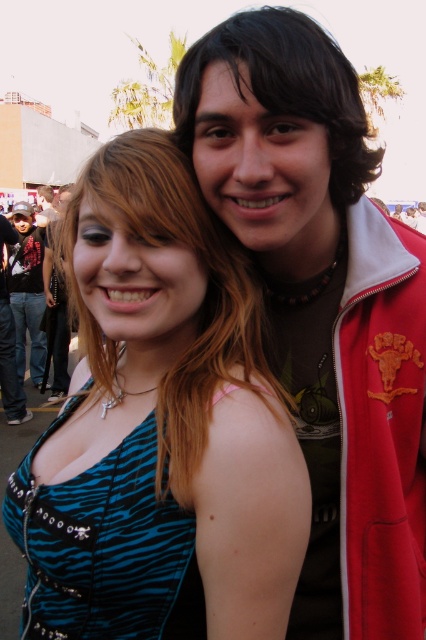
You are a photographer at a beach event and need to adjust your camera settings to capture both the matte brown hair at upper center and the brushed metal jacket at left in focus. Given that the depth of field can cover objects within a 5 meter range, will you need to adjust your focus to include both subjects?

The matte brown hair at upper center and the brushed metal jacket at left are 7.22 meters apart from each other. Since the depth of field can only cover 5 meters, you will need to adjust your focus to ensure both are in focus.